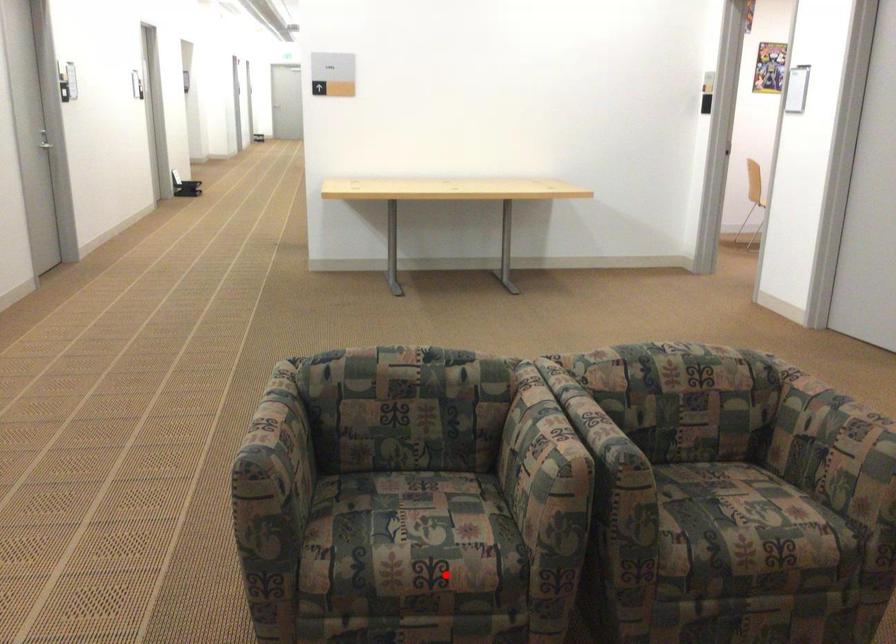
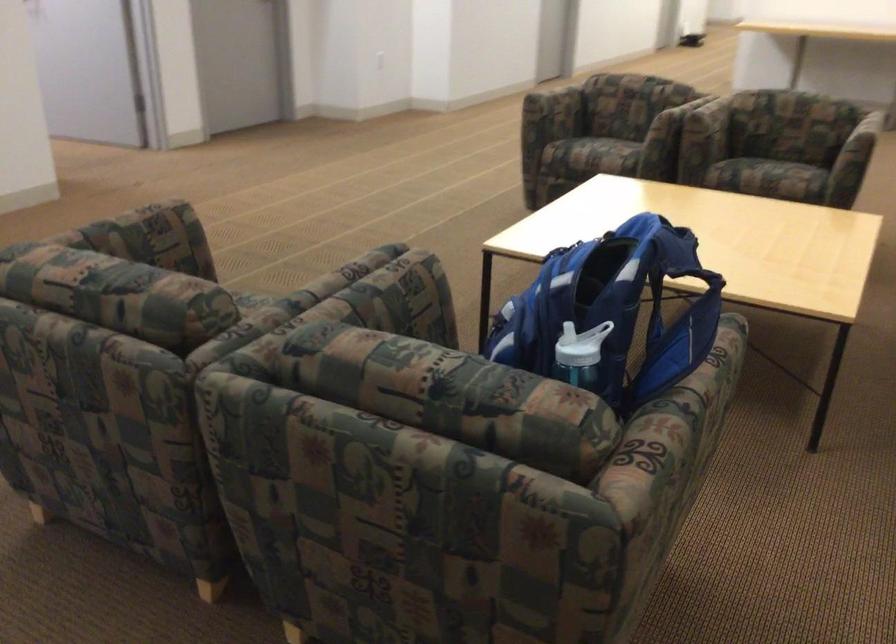
Question: I am providing you with two images of the same scene from different viewpoints. Given a red point in image1, look at the same physical point in image2. Is it:

Choices:
 (A) Closer to the viewpoint
 (B) Farther from the viewpoint

Answer: (B)